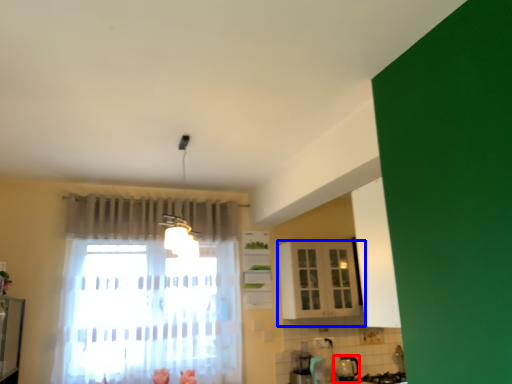
Question: Among these objects, which one is farthest to the camera, appliance (highlighted by a red box) or cabinetry (highlighted by a blue box)?

Choices:
 (A) appliance
 (B) cabinetry

Answer: (A)